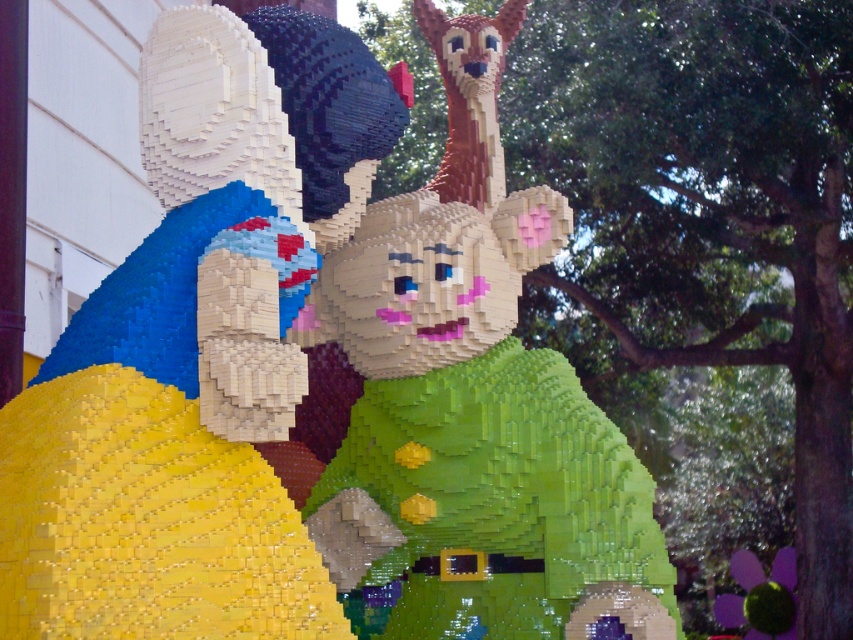
Question: Is yellow matte brick at left smaller than green matte/soft toy at center?

Choices:
 (A) no
 (B) yes

Answer: (B)

Question: From the image, what is the correct spatial relationship of yellow matte brick at left in relation to green matte/soft toy at center?

Choices:
 (A) below
 (B) above

Answer: (A)

Question: Can you confirm if yellow matte brick at left is wider than green matte/soft toy at center?

Choices:
 (A) yes
 (B) no

Answer: (B)